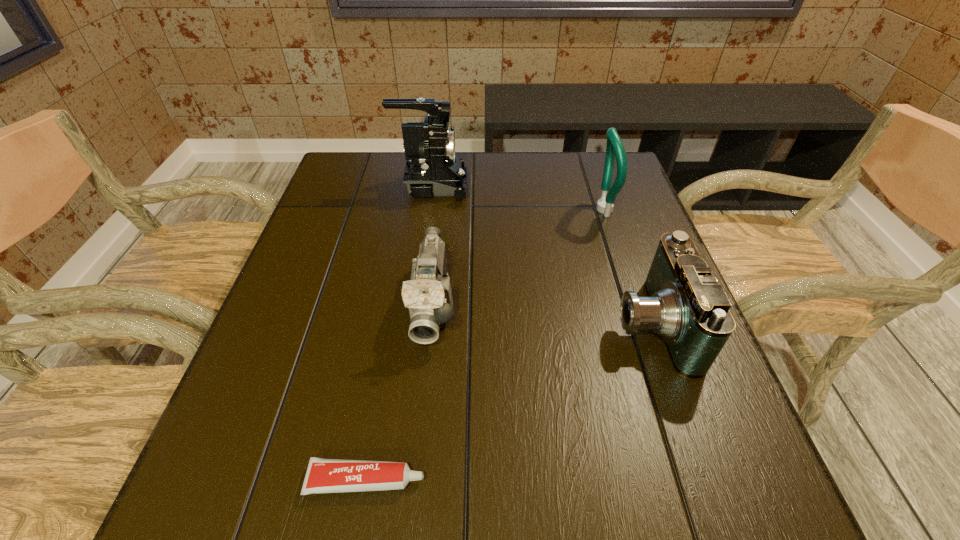
I want to click on free space between the bottle opener and the toothpaste, so click(x=484, y=345).

At what (x,y) coordinates should I click in order to perform the action: click on free space between the rightmost camcorder and the toothpaste. Please return your answer as a coordinate pair (x, y). The height and width of the screenshot is (540, 960). Looking at the image, I should click on (509, 402).

Locate an element on the screen. The height and width of the screenshot is (540, 960). vacant area between the rightmost camcorder and the tallest camcorder is located at coordinates (541, 255).

Where is `vacant space in between the tallest camcorder and the rightmost camcorder`? The height and width of the screenshot is (540, 960). vacant space in between the tallest camcorder and the rightmost camcorder is located at coordinates (541, 255).

Identify which object is the fourth closest to the bottle opener. Please provide its 2D coordinates. Your answer should be formatted as a tuple, i.e. [(x, y)], where the tuple contains the x and y coordinates of a point satisfying the conditions above.

[(323, 475)]

Identify which object is the third closest to the rightmost camcorder. Please provide its 2D coordinates. Your answer should be formatted as a tuple, i.e. [(x, y)], where the tuple contains the x and y coordinates of a point satisfying the conditions above.

[(323, 475)]

The height and width of the screenshot is (540, 960). I want to click on the closest camcorder relative to the nearest object, so click(428, 295).

Identify the location of camcorder that is the second closest one to the farthest camcorder. (685, 304).